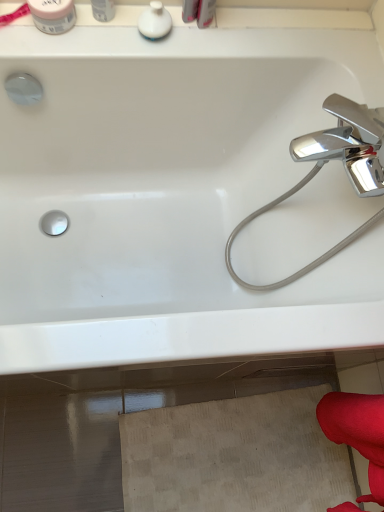
Question: Considering the positions of white glossy bathtub at upper center and white matte jar at upper left, the 1th toiletry positioned from the left, in the image, is white glossy bathtub at upper center taller or shorter than white matte jar at upper left, the 1th toiletry positioned from the left,?

Choices:
 (A) short
 (B) tall

Answer: (B)

Question: Visually, is white glossy bathtub at upper center positioned to the left or to the right of white matte jar at upper left, the 1th toiletry positioned from the left?

Choices:
 (A) left
 (B) right

Answer: (B)

Question: Based on their relative distances, which object is nearer to the white matte jar at upper left, the 1th toiletry positioned from the left?

Choices:
 (A) white glossy bathtub at upper center
 (B) white glossy container at upper left, placed as the 2th toiletry when sorted from left to right
 (C) white glossy soap dispenser at upper center, the third toiletry in the left-to-right sequence

Answer: (B)

Question: Considering the real-world distances, which object is farthest from the white glossy soap dispenser at upper center, the third toiletry in the left-to-right sequence?

Choices:
 (A) white glossy bathtub at upper center
 (B) white matte jar at upper left, the 1th toiletry positioned from the left
 (C) white glossy container at upper left, acting as the 2th toiletry starting from the right

Answer: (A)